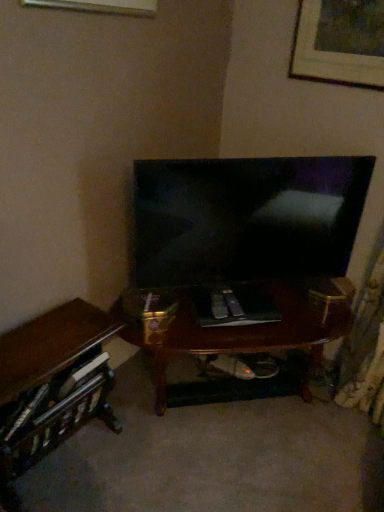
Question: Considering the relative sizes of matte black tv at center and wooden picture frame at upper right in the image provided, is matte black tv at center taller than wooden picture frame at upper right?

Choices:
 (A) yes
 (B) no

Answer: (A)

Question: Is the depth of matte black tv at center less than that of wooden picture frame at upper right?

Choices:
 (A) yes
 (B) no

Answer: (A)

Question: Considering the relative positions of matte black tv at center and wooden picture frame at upper right in the image provided, is matte black tv at center to the right of wooden picture frame at upper right from the viewer's perspective?

Choices:
 (A) yes
 (B) no

Answer: (B)

Question: Is matte black tv at center oriented away from wooden picture frame at upper right?

Choices:
 (A) no
 (B) yes

Answer: (A)

Question: From a real-world perspective, is matte black tv at center physically above wooden picture frame at upper right?

Choices:
 (A) no
 (B) yes

Answer: (A)

Question: Can you confirm if matte black tv at center is wider than wooden picture frame at upper right?

Choices:
 (A) yes
 (B) no

Answer: (A)

Question: Is wooden picture frame at upper right thinner than matte black tv at center?

Choices:
 (A) yes
 (B) no

Answer: (A)

Question: Can you confirm if wooden picture frame at upper right is shorter than matte black tv at center?

Choices:
 (A) yes
 (B) no

Answer: (A)

Question: From the image's perspective, is wooden picture frame at upper right located above matte black tv at center?

Choices:
 (A) yes
 (B) no

Answer: (A)

Question: From a real-world perspective, is wooden picture frame at upper right located beneath matte black tv at center?

Choices:
 (A) yes
 (B) no

Answer: (B)

Question: Does wooden picture frame at upper right turn towards matte black tv at center?

Choices:
 (A) no
 (B) yes

Answer: (A)

Question: Considering the relative positions of wooden picture frame at upper right and matte black tv at center in the image provided, is wooden picture frame at upper right to the right of matte black tv at center from the viewer's perspective?

Choices:
 (A) no
 (B) yes

Answer: (B)

Question: Would you say wooden desk at lower left is outside matte black tv at center?

Choices:
 (A) no
 (B) yes

Answer: (B)